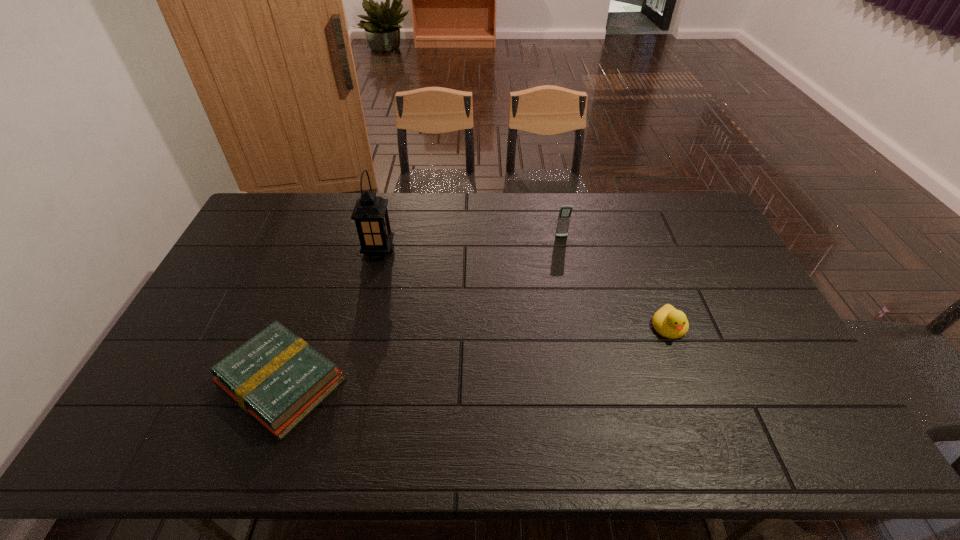
Locate an element on the screen. object that stands as the third closest to the rightmost object is located at coordinates (276, 377).

In order to click on free space that satisfies the following two spatial constraints: 1. on the back side of the hardback book; 2. on the left side of the third nearest object in this screenshot , I will do `click(329, 251)`.